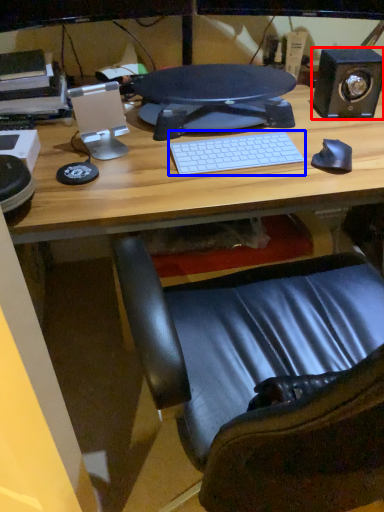
Question: Which object appears farthest to the camera in this image, speaker (highlighted by a red box) or computer keyboard (highlighted by a blue box)?

Choices:
 (A) speaker
 (B) computer keyboard

Answer: (A)